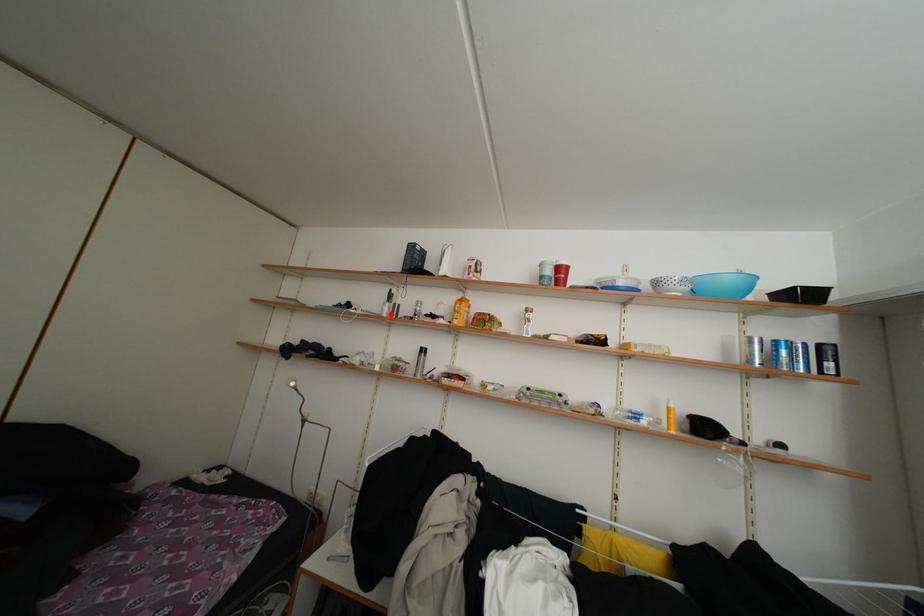
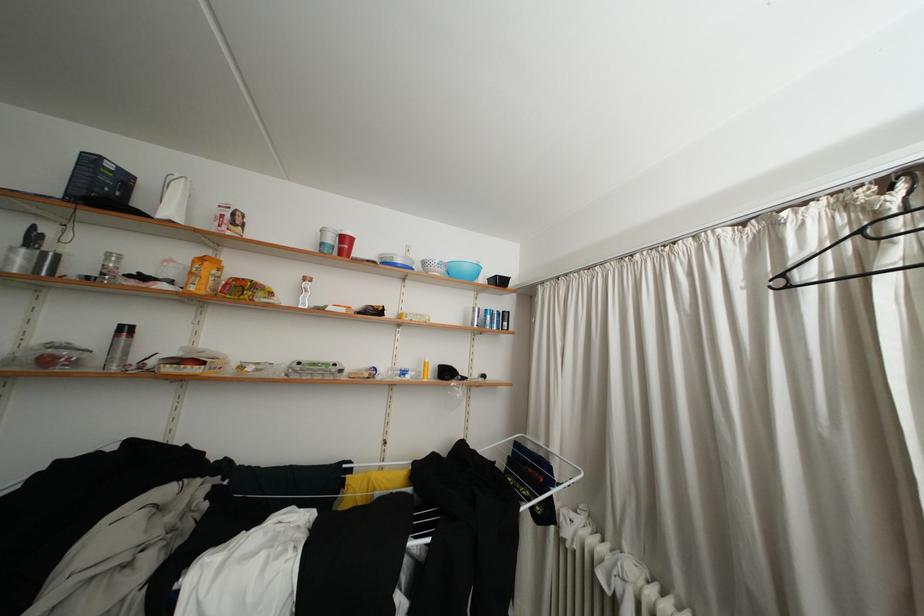
In the second image, find the point that corresponds to the highlighted location in the first image.

(17, 264)